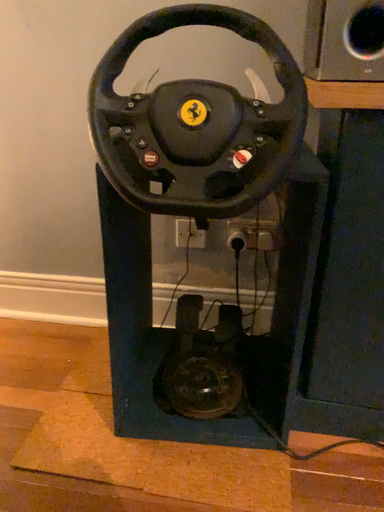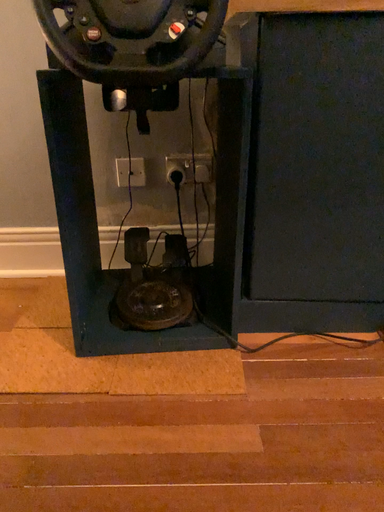
Question: Which way did the camera rotate in the video?

Choices:
 (A) rotated right
 (B) rotated left

Answer: (A)